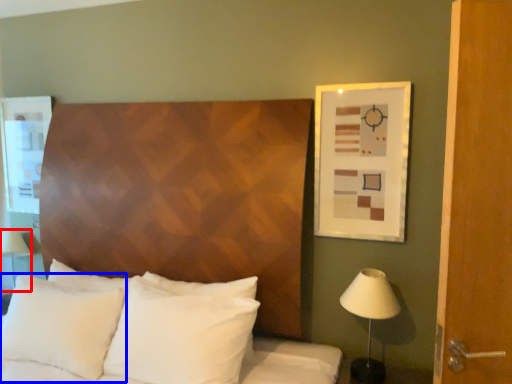
Question: Which object appears closest to the camera in this image, table lamp (highlighted by a red box) or pillow (highlighted by a blue box)?

Choices:
 (A) table lamp
 (B) pillow

Answer: (B)